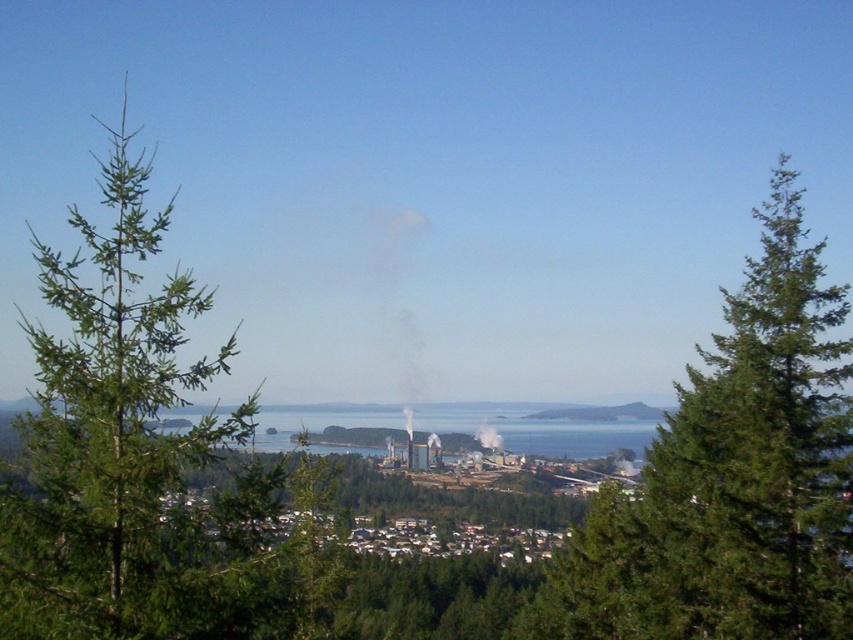
Who is lower down, green textured tree at center or green needle-like tree at left?

Positioned lower is green textured tree at center.

Who is more distant from viewer, (751, 376) or (149, 317)?

The point (751, 376) is more distant.

Where is `green textured tree at center`? This screenshot has height=640, width=853. green textured tree at center is located at coordinates (732, 477).